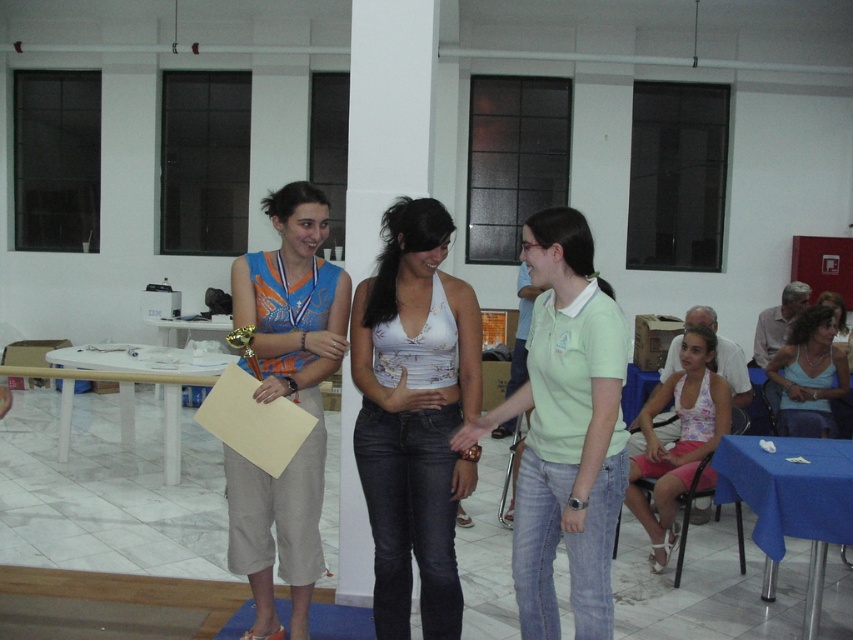
Question: Based on their relative distances, which object is farther from the light green cotton shirt at center?

Choices:
 (A) light blue tank top at center
 (B) blue printed dress at center
 (C) floral fabric dress at lower right
 (D) white cotton tank top at center

Answer: (A)

Question: Which point is closer to the camera taking this photo?

Choices:
 (A) (621, 353)
 (B) (376, 532)
 (C) (780, 353)
 (D) (267, 612)

Answer: (A)

Question: Can you confirm if blue printed dress at center is positioned to the left of light blue tank top at center?

Choices:
 (A) yes
 (B) no

Answer: (A)

Question: Does light green cotton shirt at center have a larger size compared to floral fabric dress at lower right?

Choices:
 (A) yes
 (B) no

Answer: (B)

Question: Is light green cotton shirt at center behind blue printed dress at center?

Choices:
 (A) no
 (B) yes

Answer: (A)

Question: Which object is positioned farthest from the light blue tank top at center?

Choices:
 (A) floral fabric dress at lower right
 (B) light green cotton shirt at center

Answer: (B)